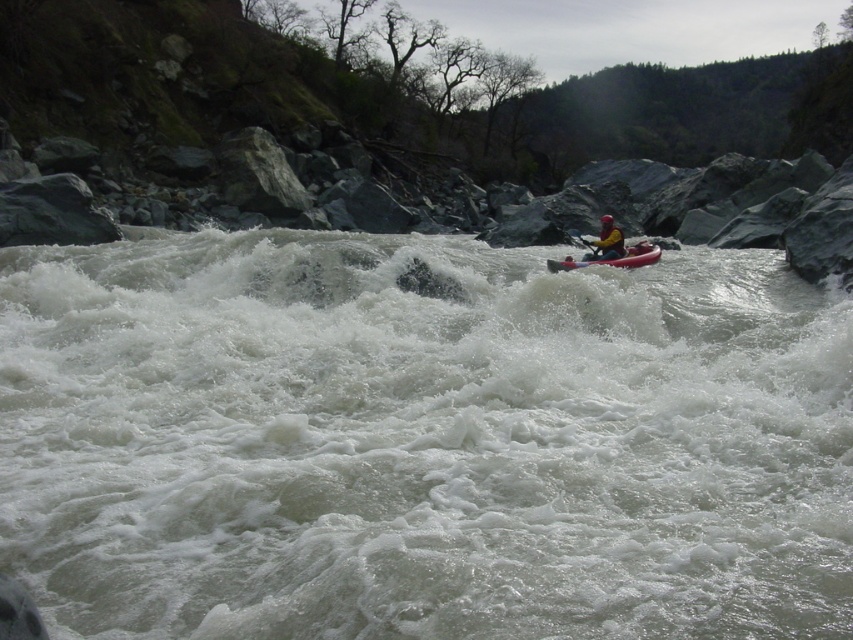
Question: Does rubber kayak at center have a lesser width compared to yellow fabric kayak at center?

Choices:
 (A) no
 (B) yes

Answer: (B)

Question: Is rubber kayak at center thinner than white foam paddle at center?

Choices:
 (A) yes
 (B) no

Answer: (B)

Question: Which of these objects is positioned closest to the white frothy water at center?

Choices:
 (A) yellow fabric kayak at center
 (B) white foam paddle at center
 (C) rubber kayak at center

Answer: (C)

Question: Is rubber kayak at center behind white foam paddle at center?

Choices:
 (A) yes
 (B) no

Answer: (B)

Question: Which point appears farthest from the camera in this image?

Choices:
 (A) (749, 291)
 (B) (567, 232)

Answer: (B)

Question: Which point is farther to the camera?

Choices:
 (A) pyautogui.click(x=653, y=259)
 (B) pyautogui.click(x=640, y=403)
 (C) pyautogui.click(x=567, y=232)

Answer: (C)